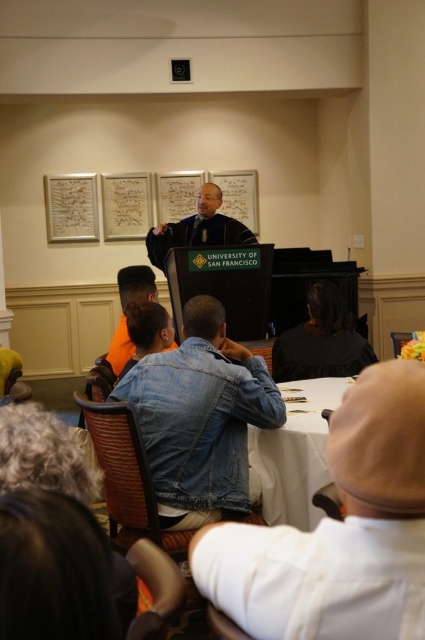
Can you confirm if white glossy table at center is bigger than black fabric at center?

Yes, white glossy table at center is bigger than black fabric at center.

Is point (291, 429) farther from viewer compared to point (342, 308)?

No, (291, 429) is closer to viewer.

This screenshot has height=640, width=425. What do you see at coordinates (295, 456) in the screenshot? I see `white glossy table at center` at bounding box center [295, 456].

You are a GUI agent. You are given a task and a screenshot of the screen. Output one action in this format:
    pyautogui.click(x=<x>, y=<y>)
    Task: Click on the white glossy table at center
    The height and width of the screenshot is (640, 425).
    Given the screenshot: What is the action you would take?
    pyautogui.click(x=295, y=456)

Is black fabric at center wider than orange fabric at center?

Yes.

Is black fabric at center closer to the viewer compared to orange fabric at center?

No, black fabric at center is behind orange fabric at center.

The height and width of the screenshot is (640, 425). I want to click on black fabric at center, so click(320, 340).

Find the location of a particular element. The image size is (425, 640). black fabric at center is located at coordinates (320, 340).

Identify the location of denim jacket at center. Image resolution: width=425 pixels, height=640 pixels. (201, 419).